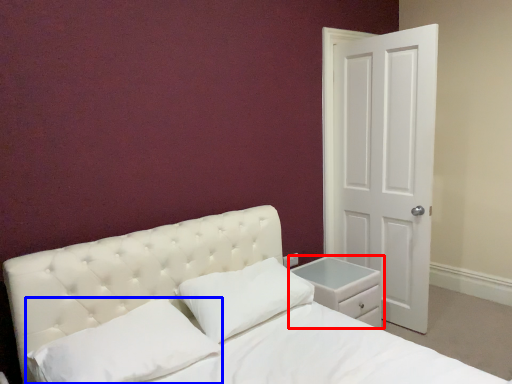
Question: Which object is further to the camera taking this photo, nightstand (highlighted by a red box) or pillow (highlighted by a blue box)?

Choices:
 (A) nightstand
 (B) pillow

Answer: (A)